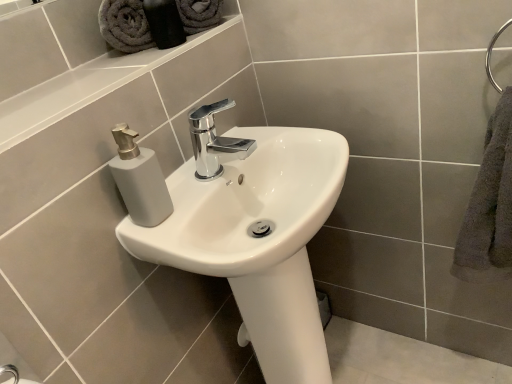
Question: Does point (484, 188) appear closer or farther from the camera than point (135, 21)?

Choices:
 (A) closer
 (B) farther

Answer: (A)

Question: Would you say gray fluffy towel at right, which ranks as the first bath towel in bottom-to-top order, is to the left or to the right of gray cotton towel at upper left, acting as the first bath towel starting from the top, in the picture?

Choices:
 (A) right
 (B) left

Answer: (A)

Question: Which of these objects is positioned farthest from the gray fluffy towel at right, which is counted as the second bath towel, starting from the left?

Choices:
 (A) gray cotton towel at upper left, positioned as the second bath towel in right-to-left order
 (B) white glossy sink at center
 (C) gray fabric towels at upper left
 (D) white glossy ledge at upper left
 (E) chrome metallic faucet at center

Answer: (A)

Question: Estimate the real-world distances between objects in this image. Which object is farther from the gray fabric towels at upper left?

Choices:
 (A) white glossy ledge at upper left
 (B) gray cotton towel at upper left, acting as the first bath towel starting from the top
 (C) white glossy sink at center
 (D) chrome metallic faucet at center
 (E) gray fluffy towel at right, which is counted as the second bath towel, starting from the left

Answer: (E)